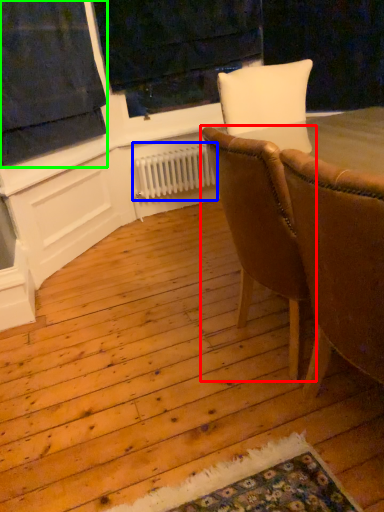
Question: Which object is the closest to the chair (highlighted by a red box)? Choose among these: radiator (highlighted by a blue box) or curtain (highlighted by a green box).

Choices:
 (A) radiator
 (B) curtain

Answer: (B)